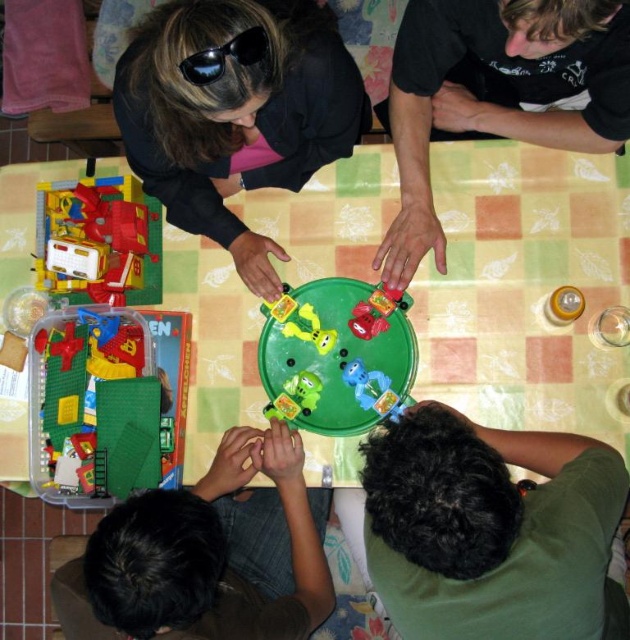
Is dark green shirt at lower right smaller than brown hair at lower left?

Indeed, dark green shirt at lower right has a smaller size compared to brown hair at lower left.

Who is shorter, dark green shirt at lower right or brown hair at lower left?

With less height is dark green shirt at lower right.

Between point (541, 564) and point (289, 600), which one is positioned in front?

Point (541, 564)

Image resolution: width=630 pixels, height=640 pixels. Identify the location of dark green shirt at lower right. (488, 529).

Image resolution: width=630 pixels, height=640 pixels. What are the coordinates of `sunglasses at upper center` in the screenshot? It's located at (224, 56).

The width and height of the screenshot is (630, 640). What do you see at coordinates (224, 56) in the screenshot?
I see `sunglasses at upper center` at bounding box center [224, 56].

Find the location of a particular element. The width and height of the screenshot is (630, 640). sunglasses at upper center is located at coordinates (224, 56).

Does green plastic table at center have a greater width compared to brown hair at lower left?

Indeed, green plastic table at center has a greater width compared to brown hair at lower left.

Consider the image. Is green plastic table at center to the left of brown hair at lower left from the viewer's perspective?

Incorrect, green plastic table at center is not on the left side of brown hair at lower left.

Between point (581, 200) and point (289, 536), which one is positioned in front?

Positioned in front is point (289, 536).

At what (x,y) coordinates should I click in order to perform the action: click on green plastic table at center. Please return your answer as a coordinate pair (x, y). This screenshot has width=630, height=640. Looking at the image, I should click on (525, 288).